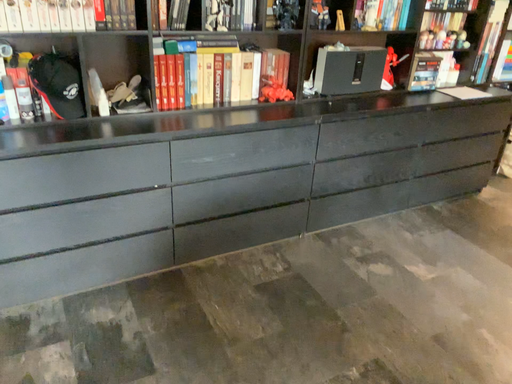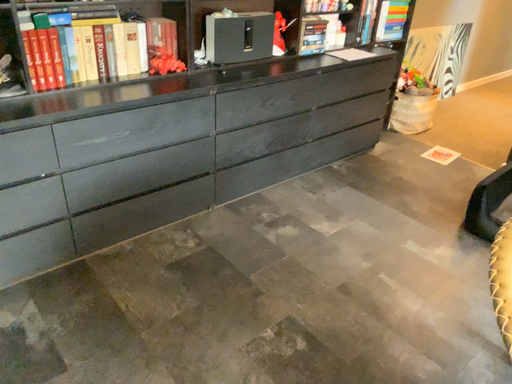
Question: How did the camera likely rotate when shooting the video?

Choices:
 (A) rotated right
 (B) rotated left

Answer: (A)